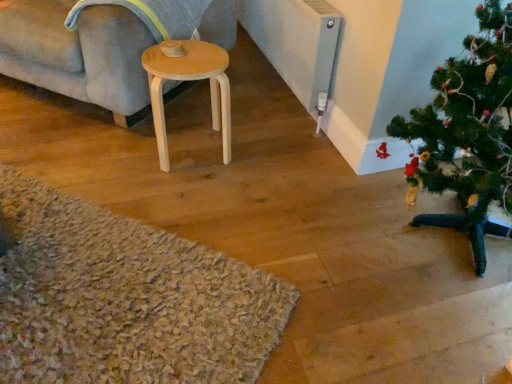
Identify the location of vacant area to the left of green matte christmas tree at lower right. This screenshot has width=512, height=384. (315, 264).